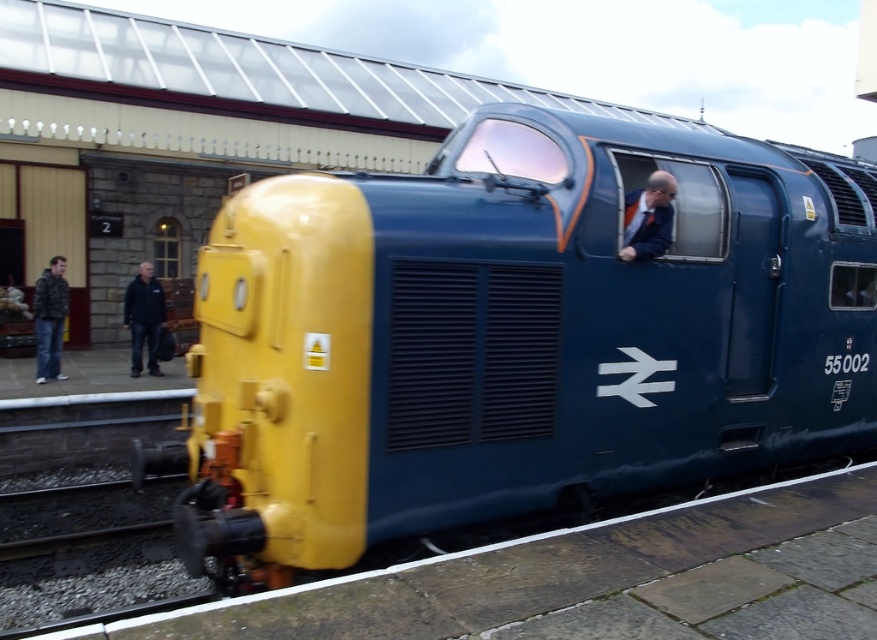
Question: Where is dark gray jacket at left located in relation to black jacket at left in the image?

Choices:
 (A) left
 (B) right

Answer: (A)

Question: Where is dark gray jacket at left located in relation to black jacket at left in the image?

Choices:
 (A) left
 (B) right

Answer: (A)

Question: Which of the following is the closest to the observer?

Choices:
 (A) dark gray jacket at left
 (B) matte blue train at center
 (C) matte blue suit at center

Answer: (B)

Question: Does matte blue train at center have a greater width compared to matte blue suit at center?

Choices:
 (A) no
 (B) yes

Answer: (B)

Question: Which point appears farthest from the camera in this image?

Choices:
 (A) (134, 317)
 (B) (45, 298)
 (C) (408, 259)

Answer: (A)

Question: Which of the following is the closest to the observer?

Choices:
 (A) (61, 259)
 (B) (136, 284)

Answer: (A)